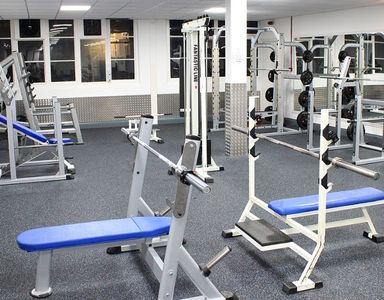
You are a GUI agent. You are given a task and a screenshot of the screen. Output one action in this format:
    pyautogui.click(x=<x>, y=<y>)
    Task: Click on the workout machines
    The height and width of the screenshot is (300, 384).
    Given the screenshot: What is the action you would take?
    pyautogui.click(x=56, y=141), pyautogui.click(x=134, y=213), pyautogui.click(x=201, y=79), pyautogui.click(x=80, y=129), pyautogui.click(x=152, y=92), pyautogui.click(x=273, y=207), pyautogui.click(x=361, y=159), pyautogui.click(x=278, y=129)